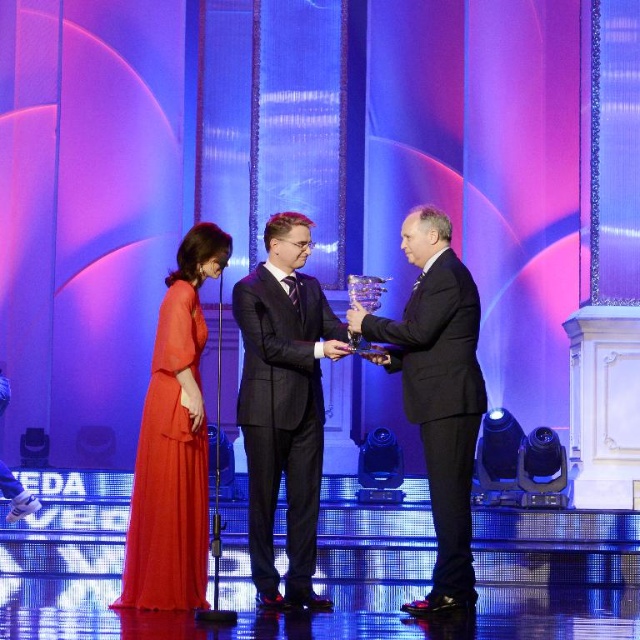
Looking at this image, can you confirm if dark gray suit at center is shorter than matte orange dress at center?

No, dark gray suit at center is not shorter than matte orange dress at center.

Can you confirm if dark gray suit at center is smaller than matte orange dress at center?

Actually, dark gray suit at center might be larger than matte orange dress at center.

Which is behind, point (289, 518) or point (193, 348)?

Point (289, 518)

Locate an element on the screen. dark gray suit at center is located at coordinates (x=284, y=404).

Does point (285, 545) come in front of point (433, 582)?

No, it is not.

Can you confirm if dark gray suit at center is wider than black glossy suit at center?

In fact, dark gray suit at center might be narrower than black glossy suit at center.

Find the location of a particular element. dark gray suit at center is located at coordinates pyautogui.click(x=284, y=404).

Where is `dark gray suit at center`? The height and width of the screenshot is (640, 640). dark gray suit at center is located at coordinates click(x=284, y=404).

Looking at this image, between black glossy suit at center and matte orange dress at center, which one appears on the right side from the viewer's perspective?

black glossy suit at center

Between point (456, 282) and point (177, 556), which one is positioned in front?

Point (177, 556)

The width and height of the screenshot is (640, 640). In order to click on black glossy suit at center in this screenshot , I will do `click(436, 392)`.